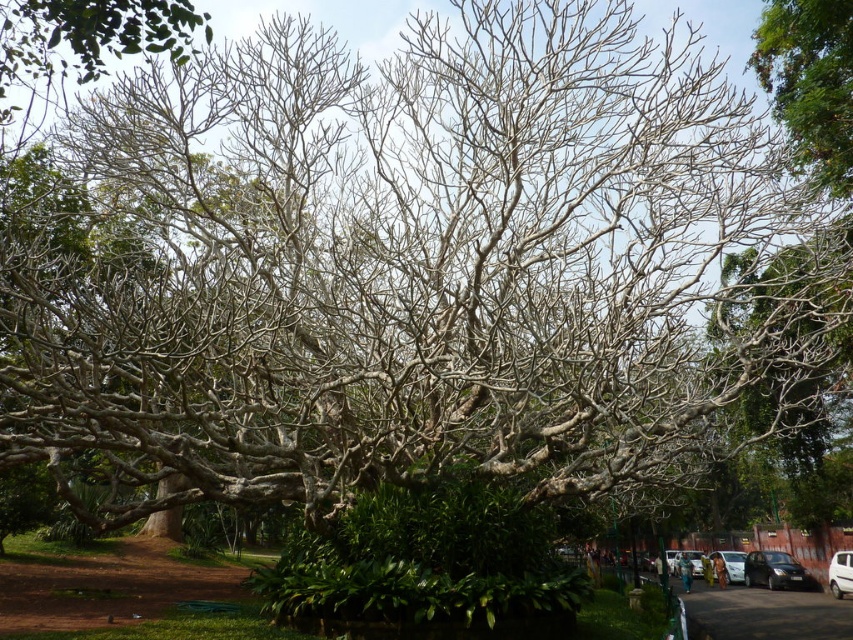
Question: Does white glossy car at center have a lesser width compared to metallic silver car at center?

Choices:
 (A) no
 (B) yes

Answer: (B)

Question: Which object is positioned farthest from the metallic silver car at center?

Choices:
 (A) metallic silver car at lower right
 (B) white glossy car at center

Answer: (B)

Question: Which point is closer to the camera?

Choices:
 (A) (837, 589)
 (B) (697, 557)
 (C) (727, 573)
 (D) (757, 560)

Answer: (A)

Question: Does shiny black car at lower right appear over metallic silver car at center?

Choices:
 (A) no
 (B) yes

Answer: (B)

Question: Considering the real-world distances, which object is closest to the metallic silver car at center?

Choices:
 (A) shiny black car at lower right
 (B) white glossy car at center
 (C) metallic silver car at lower right

Answer: (C)

Question: Can you confirm if shiny black car at lower right is positioned to the right of metallic silver car at lower right?

Choices:
 (A) yes
 (B) no

Answer: (A)